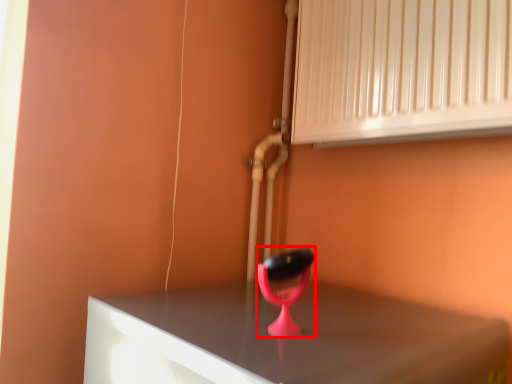
Question: From the image's perspective, what is the correct spatial relationship of table lamp (annotated by the red box) in relation to air conditioning?

Choices:
 (A) below
 (B) above

Answer: (A)